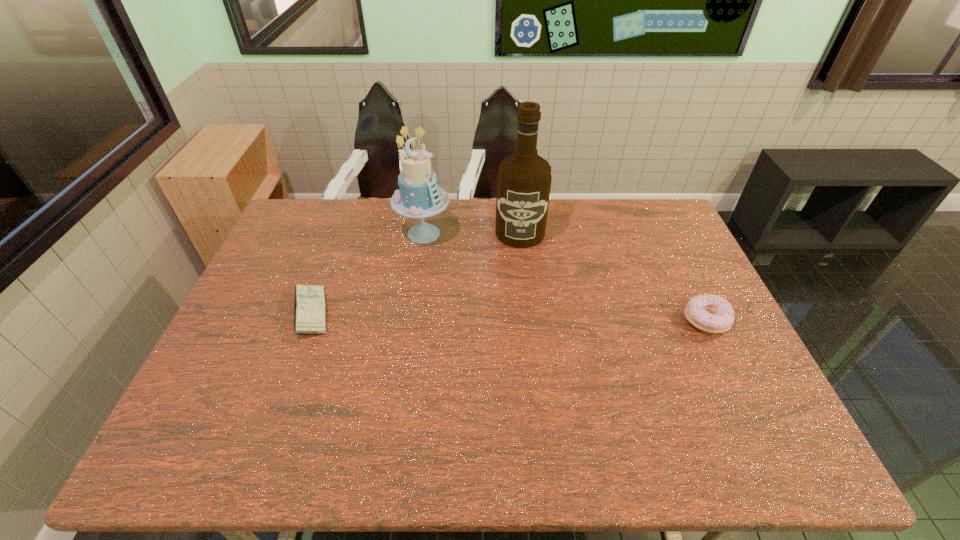
Image resolution: width=960 pixels, height=540 pixels. I want to click on vacant region at the right edge of the desktop, so click(x=648, y=265).

Find the location of a particular element. The height and width of the screenshot is (540, 960). free space at the near left corner of the desktop is located at coordinates (252, 389).

This screenshot has width=960, height=540. Find the location of `free space between the third object from right to left and the doughnut`. free space between the third object from right to left and the doughnut is located at coordinates (564, 278).

Where is `free point between the third object from right to left and the leftmost object`? The height and width of the screenshot is (540, 960). free point between the third object from right to left and the leftmost object is located at coordinates (368, 273).

Locate an element on the screen. The height and width of the screenshot is (540, 960). free space between the doughnut and the alcohol is located at coordinates (613, 277).

Locate an element on the screen. Image resolution: width=960 pixels, height=540 pixels. free space between the leftmost object and the alcohol is located at coordinates (416, 273).

This screenshot has height=540, width=960. What are the coordinates of `free area in between the third object from right to left and the third object from left to right` in the screenshot? It's located at (472, 233).

Image resolution: width=960 pixels, height=540 pixels. I want to click on free space between the rightmost object and the diary, so click(509, 317).

The width and height of the screenshot is (960, 540). Find the location of `vacant space that is in between the doughnut and the alcohol`. vacant space that is in between the doughnut and the alcohol is located at coordinates (613, 277).

At what (x,y) coordinates should I click in order to perform the action: click on free spot between the third object from left to right and the rightmost object. Please return your answer as a coordinate pair (x, y). Image resolution: width=960 pixels, height=540 pixels. Looking at the image, I should click on (613, 277).